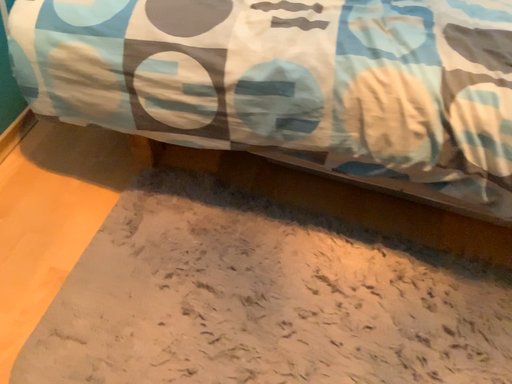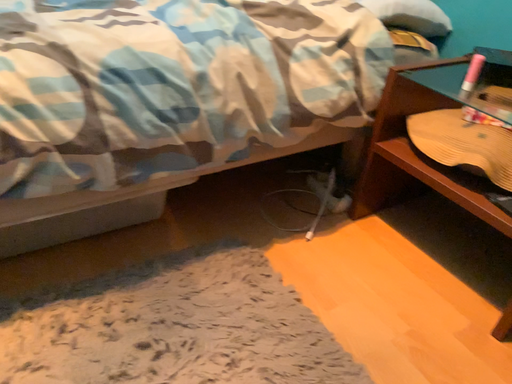
Question: How did the camera likely rotate when shooting the video?

Choices:
 (A) rotated left
 (B) rotated right

Answer: (B)